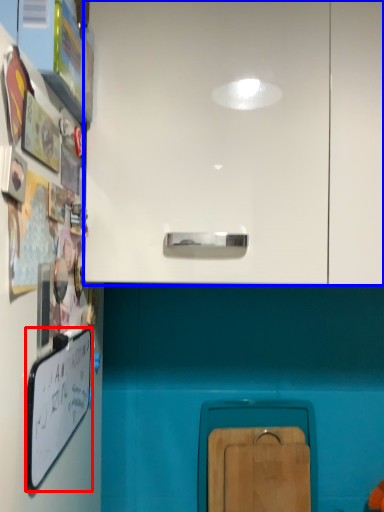
Question: Among these objects, which one is nearest to the camera, whiteboard (highlighted by a red box) or cabinetry (highlighted by a blue box)?

Choices:
 (A) whiteboard
 (B) cabinetry

Answer: (A)